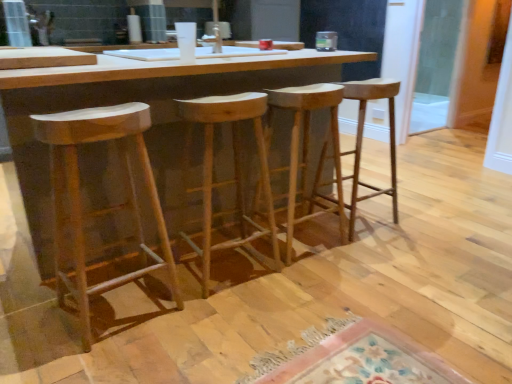
Question: Considering the relative sizes of natural wood stool at left, which ranks as the fourth stool in right-to-left order, and natural wood table at center in the image provided, is natural wood stool at left, which ranks as the fourth stool in right-to-left order, thinner than natural wood table at center?

Choices:
 (A) no
 (B) yes

Answer: (B)

Question: From the image's perspective, does natural wood stool at left, which ranks as the fourth stool in right-to-left order, appear lower than natural wood table at center?

Choices:
 (A) no
 (B) yes

Answer: (B)

Question: Is natural wood table at center at the back of natural wood stool at left, which ranks as the fourth stool in right-to-left order?

Choices:
 (A) no
 (B) yes

Answer: (A)

Question: From the image's perspective, is natural wood stool at left, the 1th stool from the left, on natural wood table at center?

Choices:
 (A) yes
 (B) no

Answer: (B)

Question: From a real-world perspective, is natural wood stool at left, the 1th stool from the left, located beneath natural wood table at center?

Choices:
 (A) yes
 (B) no

Answer: (A)

Question: Relative to natural wood stool at left, the 1th stool from the left, is natural wood stool at center, the 3th stool positioned from the left, in front or behind?

Choices:
 (A) front
 (B) behind

Answer: (B)

Question: Do you think natural wood stool at center, the 3th stool positioned from the left, is within natural wood stool at left, which ranks as the fourth stool in right-to-left order, or outside of it?

Choices:
 (A) outside
 (B) inside

Answer: (A)

Question: Considering the positions of natural wood stool at center, the 3th stool positioned from the left, and natural wood stool at left, the 1th stool from the left, in the image, is natural wood stool at center, the 3th stool positioned from the left, wider or thinner than natural wood stool at left, the 1th stool from the left,?

Choices:
 (A) wide
 (B) thin

Answer: (B)

Question: Considering the positions of natural wood stool at center, the 2th stool when ordered from right to left, and natural wood stool at left, the 1th stool from the left, in the image, is natural wood stool at center, the 2th stool when ordered from right to left, taller or shorter than natural wood stool at left, the 1th stool from the left,?

Choices:
 (A) tall
 (B) short

Answer: (B)

Question: Is natural wood stool at center, which appears as the 3th stool when viewed from the right, situated inside transparent glass door at right or outside?

Choices:
 (A) inside
 (B) outside

Answer: (B)

Question: Is point (234, 180) positioned closer to the camera than point (464, 1)?

Choices:
 (A) farther
 (B) closer

Answer: (B)

Question: Is natural wood stool at center, the second stool viewed from the left, in front of or behind transparent glass door at right in the image?

Choices:
 (A) front
 (B) behind

Answer: (A)

Question: Considering the relative positions of natural wood stool at center, the second stool viewed from the left, and transparent glass door at right in the image provided, is natural wood stool at center, the second stool viewed from the left, to the left or to the right of transparent glass door at right?

Choices:
 (A) left
 (B) right

Answer: (A)

Question: Is natural wood stool at center, the 1th stool in the right-to-left sequence, in front of or behind transparent glass door at right in the image?

Choices:
 (A) behind
 (B) front

Answer: (B)

Question: Would you say natural wood stool at center, the 1th stool in the right-to-left sequence, is to the left or to the right of transparent glass door at right in the picture?

Choices:
 (A) left
 (B) right

Answer: (A)